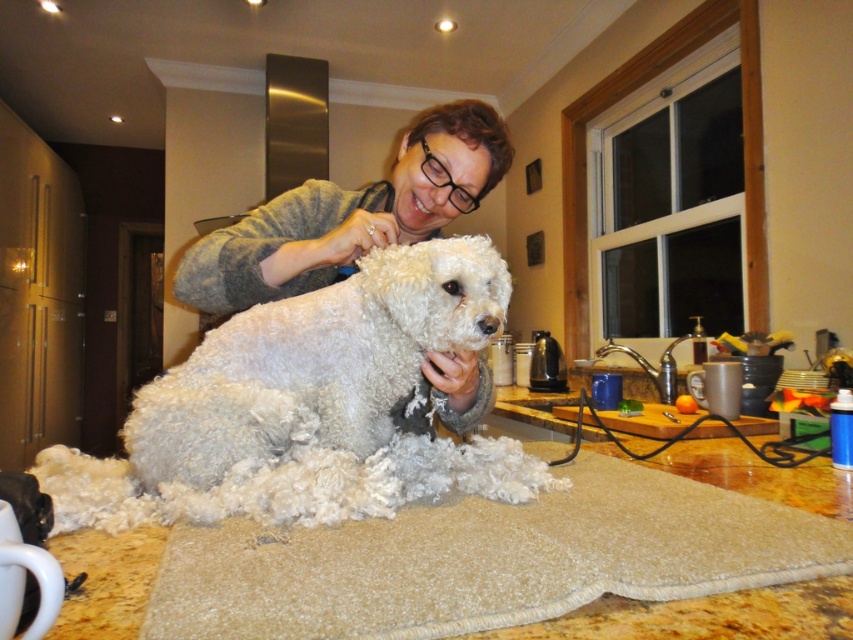
Question: Which object appears closest to the camera in this image?

Choices:
 (A) white fluffy dog at center
 (B) matte gray sweater at center
 (C) beige carpet at lower center

Answer: (C)

Question: Estimate the real-world distances between objects in this image. Which object is farther from the matte gray sweater at center?

Choices:
 (A) beige carpet at lower center
 (B) white fluffy dog at center

Answer: (A)

Question: From the image, what is the correct spatial relationship of white fluffy dog at center in relation to matte gray sweater at center?

Choices:
 (A) left
 (B) right

Answer: (A)

Question: Is beige carpet at lower center positioned behind white fluffy dog at center?

Choices:
 (A) yes
 (B) no

Answer: (B)

Question: Which point appears farthest from the camera in this image?

Choices:
 (A) (380, 401)
 (B) (496, 118)

Answer: (B)

Question: Is beige carpet at lower center in front of matte gray sweater at center?

Choices:
 (A) no
 (B) yes

Answer: (B)